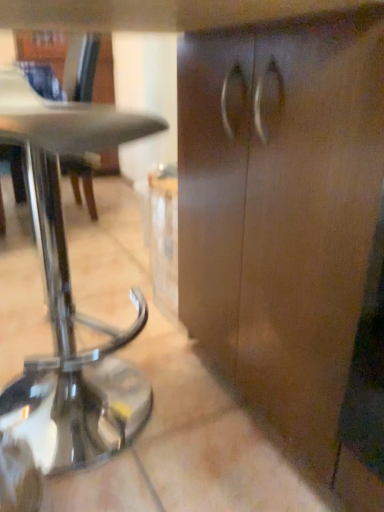
What are the coordinates of `vacant area located to the right-hand side of shiny metallic table at left` in the screenshot? It's located at (201, 418).